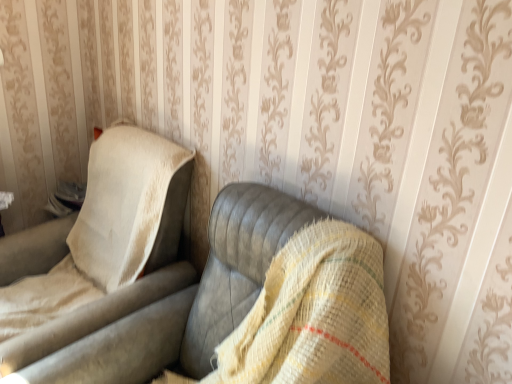
Question: Is beige fabric chair at left at the back of leather-like gray couch at center?

Choices:
 (A) yes
 (B) no

Answer: (B)

Question: Can you confirm if leather-like gray couch at center is positioned to the right of beige fabric chair at left?

Choices:
 (A) no
 (B) yes

Answer: (B)

Question: Is leather-like gray couch at center outside beige fabric chair at left?

Choices:
 (A) no
 (B) yes

Answer: (B)

Question: Is leather-like gray couch at center further to camera compared to beige fabric chair at left?

Choices:
 (A) no
 (B) yes

Answer: (A)

Question: Is leather-like gray couch at center shorter than beige fabric chair at left?

Choices:
 (A) no
 (B) yes

Answer: (A)

Question: Considering the relative sizes of leather-like gray couch at center and beige fabric chair at left in the image provided, is leather-like gray couch at center wider than beige fabric chair at left?

Choices:
 (A) no
 (B) yes

Answer: (B)

Question: From a real-world perspective, is beige fabric chair at left located beneath leather-like gray couch at center?

Choices:
 (A) no
 (B) yes

Answer: (A)

Question: Can you confirm if beige fabric chair at left is positioned to the right of leather-like gray couch at center?

Choices:
 (A) yes
 (B) no

Answer: (B)

Question: Is beige fabric chair at left not inside leather-like gray couch at center?

Choices:
 (A) yes
 (B) no

Answer: (A)

Question: From the image's perspective, is beige fabric chair at left located above leather-like gray couch at center?

Choices:
 (A) yes
 (B) no

Answer: (A)

Question: From the image's perspective, is beige fabric chair at left located beneath leather-like gray couch at center?

Choices:
 (A) no
 (B) yes

Answer: (A)

Question: Is beige fabric chair at left closer to the viewer compared to leather-like gray couch at center?

Choices:
 (A) yes
 (B) no

Answer: (B)

Question: Based on their positions, is leather-like gray couch at center located to the left or right of beige fabric chair at left?

Choices:
 (A) left
 (B) right

Answer: (B)